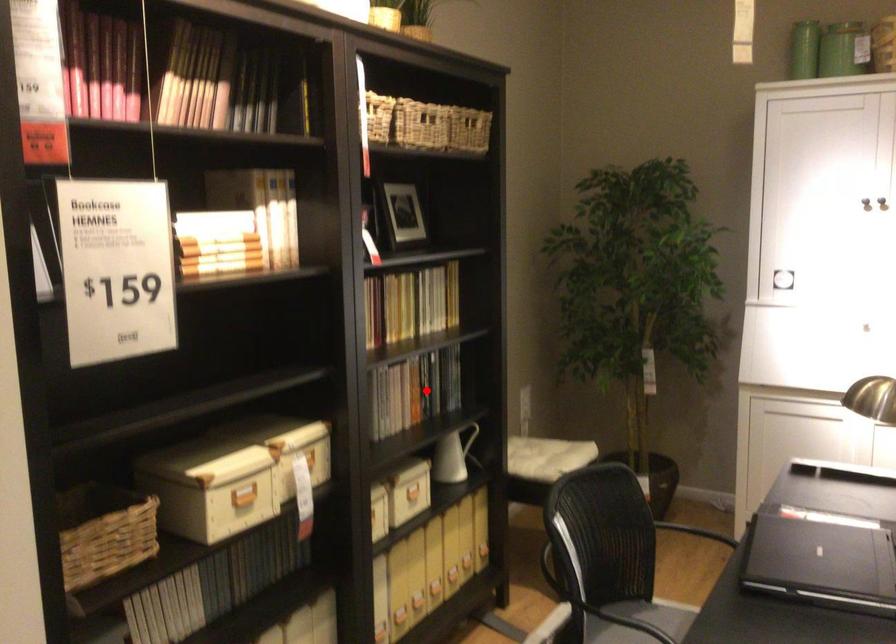
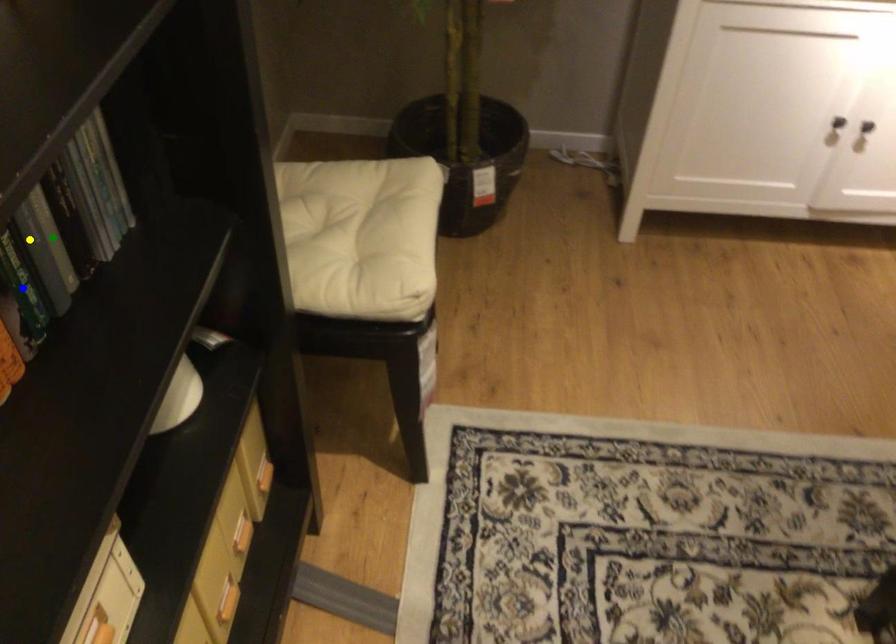
Question: I am providing you with two images of the same scene from different viewpoints. A red point is marked on the first image. You are given multiple points on the second image. Which spot in image 2 lines up with the point in image 1?

Choices:
 (A) yellow point
 (B) blue point
 (C) green point

Answer: (A)